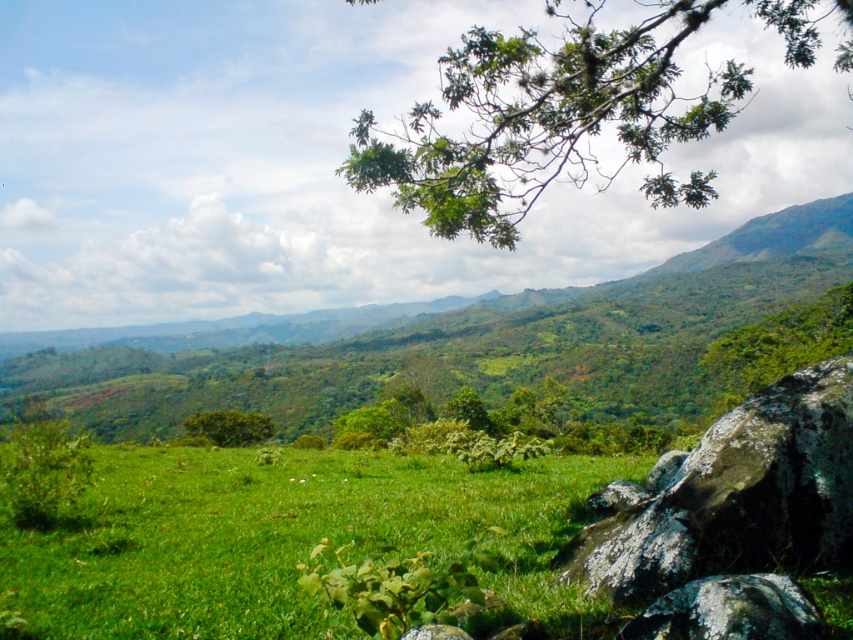
Question: Which object is the closest to the green grassy field at lower right?

Choices:
 (A) lichen-covered rock at lower right
 (B) green leafy bush at center

Answer: (A)

Question: Does green grassy field at lower right appear over lichen-covered rock at lower right?

Choices:
 (A) yes
 (B) no

Answer: (B)

Question: Can you confirm if green grassy field at lower right is positioned to the left of green leafy bush at center?

Choices:
 (A) yes
 (B) no

Answer: (B)

Question: Which of the following is the farthest from the observer?

Choices:
 (A) green leafy bush at center
 (B) green grassy field at lower right
 (C) green leafy branch at upper center

Answer: (A)

Question: Does green grassy field at lower right lie in front of green leafy branch at upper center?

Choices:
 (A) no
 (B) yes

Answer: (B)

Question: Which object is the farthest from the green grassy field at lower right?

Choices:
 (A) green leafy bush at lower left
 (B) lichen-covered rock at lower right

Answer: (A)